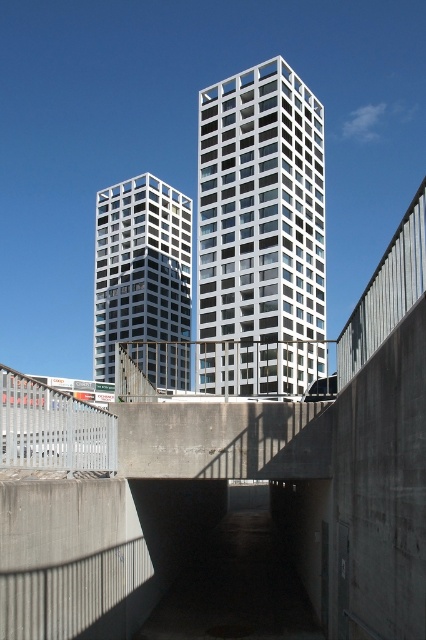
Does concrete bridge at center have a greater width compared to matte glass building at left?

Indeed, concrete bridge at center has a greater width compared to matte glass building at left.

Is concrete bridge at center further to the viewer compared to matte glass building at left?

No.

Between point (173, 369) and point (152, 218), which one is positioned behind?

Positioned behind is point (152, 218).

You are a GUI agent. You are given a task and a screenshot of the screen. Output one action in this format:
    pyautogui.click(x=<x>, y=<y>)
    Task: Click on the concrete bridge at center
    
    Given the screenshot: What is the action you would take?
    pyautogui.click(x=227, y=474)

Is concrete bridge at center above concrete at center?

Correct, concrete bridge at center is located above concrete at center.

I want to click on concrete bridge at center, so click(227, 474).

The width and height of the screenshot is (426, 640). I want to click on concrete bridge at center, so click(227, 474).

Find the location of `concrete bridge at center`. concrete bridge at center is located at coordinates (227, 474).

Does white glass building at center have a greater width compared to matte glass building at left?

Incorrect, white glass building at center's width does not surpass matte glass building at left's.

Does white glass building at center have a larger size compared to matte glass building at left?

Incorrect, white glass building at center is not larger than matte glass building at left.

Is point (307, 168) closer to camera compared to point (190, 237)?

Yes, it is.

At what (x,y) coordinates should I click in order to perform the action: click on white glass building at center. Please return your answer as a coordinate pair (x, y). The image size is (426, 640). Looking at the image, I should click on (261, 230).